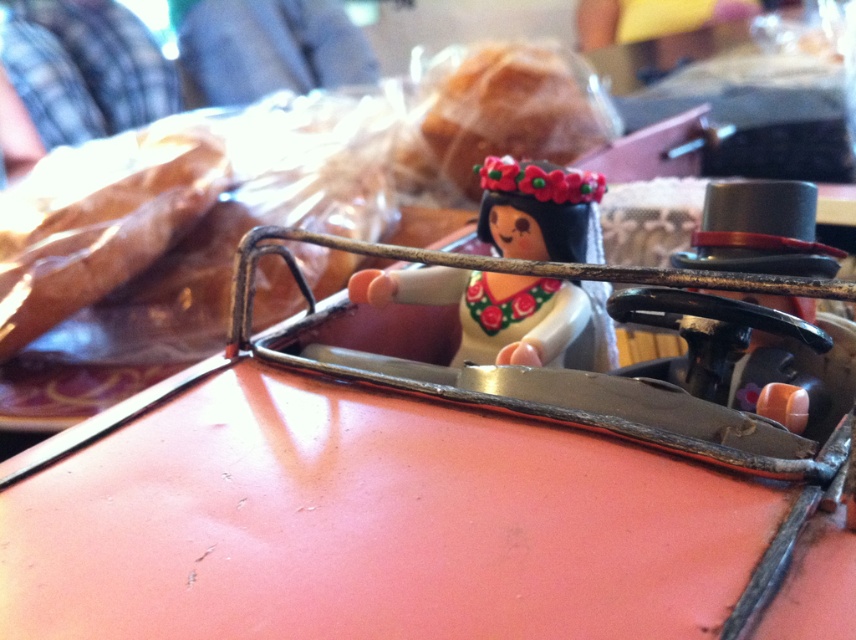
Which is more to the right, matte orange toy car at center or matte plastic doll at center?

From the viewer's perspective, matte plastic doll at center appears more on the right side.

Measure the distance between matte orange toy car at center and camera.

matte orange toy car at center is 20.45 inches away from camera.

Find the location of a particular element. Image resolution: width=856 pixels, height=640 pixels. matte orange toy car at center is located at coordinates (420, 497).

Is matte orange toy car at center above matte plastic bread at upper center?

No.

From the picture: Does matte orange toy car at center have a lesser width compared to matte plastic bread at upper center?

Yes, matte orange toy car at center is thinner than matte plastic bread at upper center.

Does point (229, 552) come closer to viewer compared to point (394, 180)?

Yes, point (229, 552) is closer to viewer.

At what (x,y) coordinates should I click in order to perform the action: click on matte orange toy car at center. Please return your answer as a coordinate pair (x, y). This screenshot has height=640, width=856. Looking at the image, I should click on (420, 497).

Can you confirm if matte plastic bread at upper center is taller than matte plastic doll at center?

Yes, matte plastic bread at upper center is taller than matte plastic doll at center.

Which is above, matte plastic bread at upper center or matte plastic doll at center?

matte plastic bread at upper center is higher up.

Find the location of a particular element. Image resolution: width=856 pixels, height=640 pixels. matte plastic bread at upper center is located at coordinates (298, 189).